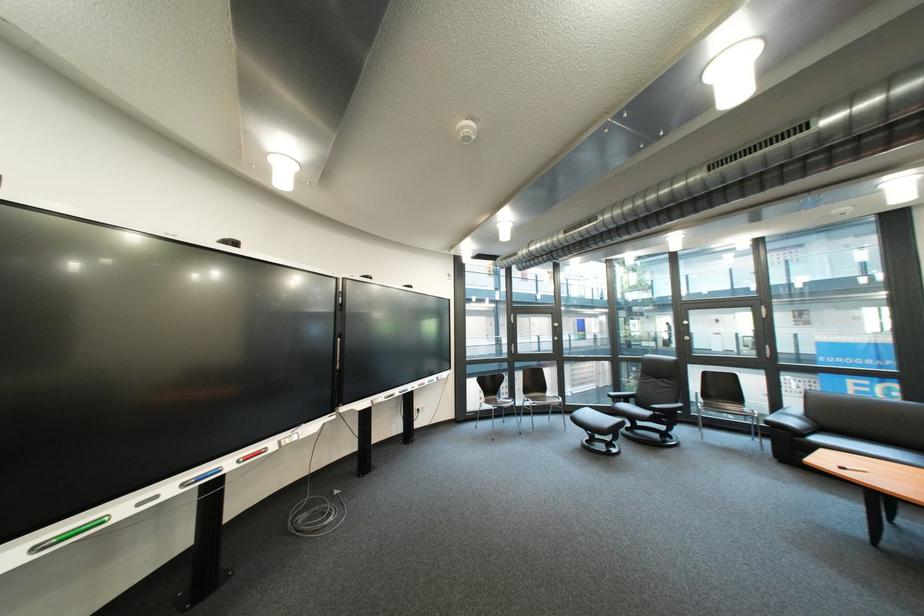
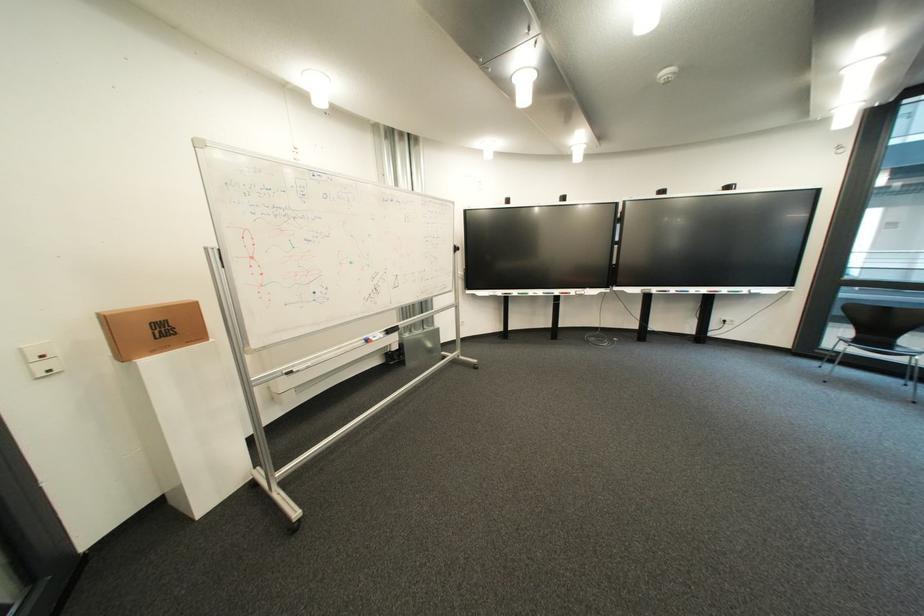
Find the pixel in the second image that matches (500,403) in the first image.

(870, 342)